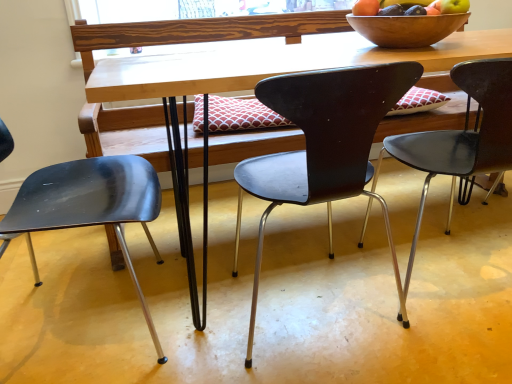
Question: Is matte black chair at center, arranged as the 3th chair when viewed from the left, touching matte black chair at center, marked as the 2th chair in a right-to-left arrangement?

Choices:
 (A) yes
 (B) no

Answer: (B)

Question: Does matte black chair at center, arranged as the 3th chair when viewed from the left, have a larger size compared to matte black chair at center, marked as the 2th chair in a right-to-left arrangement?

Choices:
 (A) yes
 (B) no

Answer: (B)

Question: Is matte black chair at center, arranged as the 3th chair when viewed from the left, facing towards matte black chair at center, marked as the 2th chair in a right-to-left arrangement?

Choices:
 (A) yes
 (B) no

Answer: (B)

Question: Does matte black chair at center, arranged as the 3th chair when viewed from the left, have a greater width compared to matte black chair at center, the 2th chair positioned from the left?

Choices:
 (A) yes
 (B) no

Answer: (B)

Question: Can you confirm if matte black chair at center, arranged as the 3th chair when viewed from the left, is taller than matte black chair at center, the 2th chair positioned from the left?

Choices:
 (A) yes
 (B) no

Answer: (B)

Question: Considering the positions of point (399, 41) and point (339, 66), is point (399, 41) closer or farther from the camera than point (339, 66)?

Choices:
 (A) farther
 (B) closer

Answer: (A)

Question: Is wooden bowl at upper right taller or shorter than wooden desk at center?

Choices:
 (A) short
 (B) tall

Answer: (A)

Question: Choose the correct answer: Is wooden bowl at upper right inside wooden desk at center or outside it?

Choices:
 (A) inside
 (B) outside

Answer: (B)

Question: Relative to wooden desk at center, is wooden bowl at upper right in front or behind?

Choices:
 (A) behind
 (B) front

Answer: (A)

Question: Considering the positions of point (95, 213) and point (437, 172), is point (95, 213) closer or farther from the camera than point (437, 172)?

Choices:
 (A) farther
 (B) closer

Answer: (B)

Question: In the image, is metallic black chair at left, arranged as the first chair when viewed from the left, on the left side or the right side of matte black chair at center, arranged as the 3th chair when viewed from the left?

Choices:
 (A) right
 (B) left

Answer: (B)

Question: Considering their positions, is metallic black chair at left, arranged as the first chair when viewed from the left, located in front of or behind matte black chair at center, arranged as the first chair when viewed from the right?

Choices:
 (A) front
 (B) behind

Answer: (A)

Question: From their relative heights in the image, would you say metallic black chair at left, arranged as the first chair when viewed from the left, is taller or shorter than matte black chair at center, arranged as the first chair when viewed from the right?

Choices:
 (A) short
 (B) tall

Answer: (A)

Question: Looking at the image, does matte black chair at center, the 2th chair positioned from the left, seem bigger or smaller compared to metallic black chair at left, the 3th chair positioned from the right?

Choices:
 (A) big
 (B) small

Answer: (B)

Question: From a real-world perspective, relative to metallic black chair at left, the 3th chair positioned from the right, is matte black chair at center, marked as the 2th chair in a right-to-left arrangement, vertically above or below?

Choices:
 (A) below
 (B) above

Answer: (B)